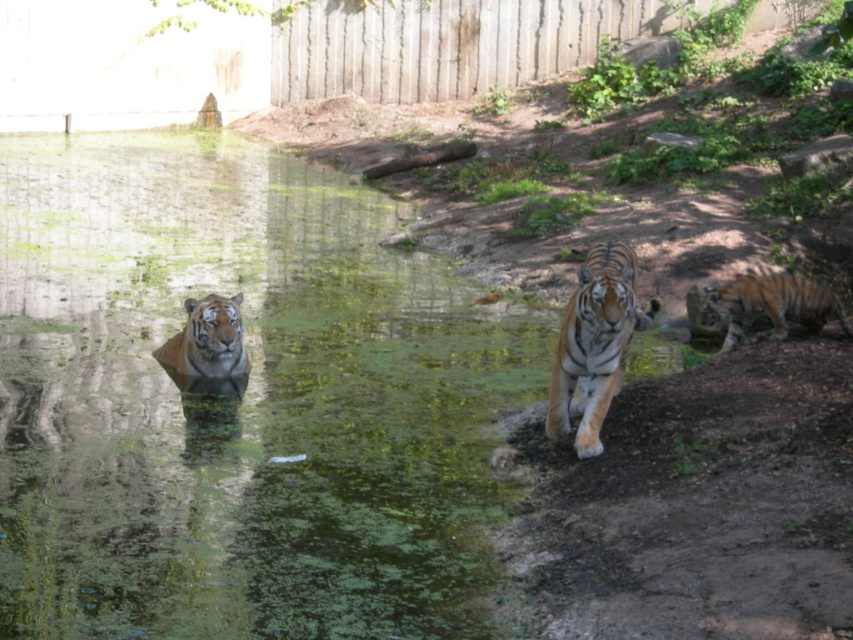
You are a zookeeper observing the tigers in the enclosure. You notice two points marked in the image. The first point is at coordinates point (573, 436) and the second point is at point (706, 298). Which of these two points is closer to the camera?

Point (573, 436) is in front of point (706, 298), so it is closer to the camera.

You are a zookeeper standing at the origin point of the zoo enclosure. You need to locate the orange striped tiger at center. According to the coordinates, in which direction should you move to reach it?

The orange striped tiger at center is located at coordinates point (x=595, y=344). Since the origin point is at the bottom left corner, moving towards the right and upwards will lead you to the tiger.

You are standing at the origin point of the coordinate system in the zoo enclosure. The orange striped tiger at center is located at coordinates 0.539, 0.698. If you want to walk directly towards the tiger, which direction should you head?

To reach the orange striped tiger at center located at coordinates (595, 344) from the origin, you should move northeast since the coordinates are positive in both x and y directions.